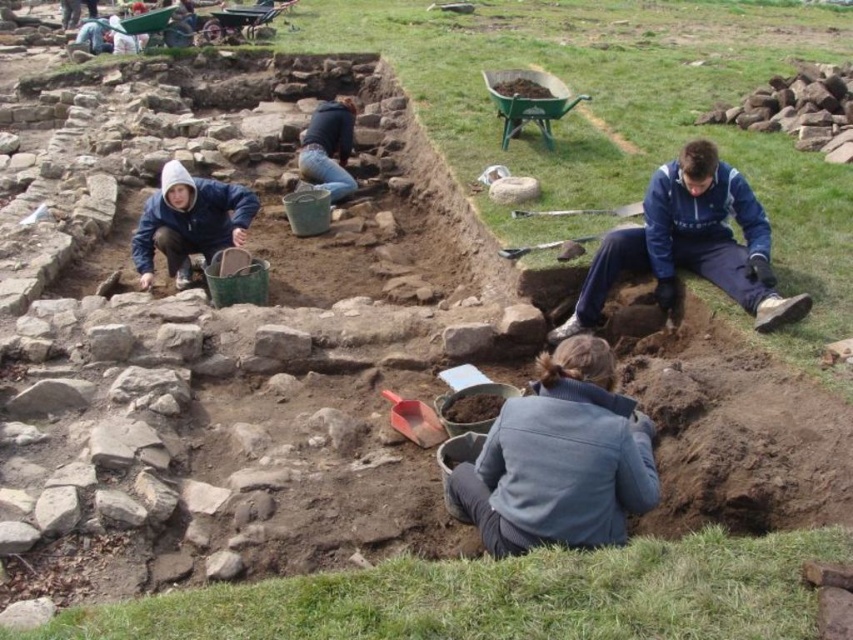
Who is lower down, blue denim jeans at center or brushed metal shovel at center?

brushed metal shovel at center is below.

Describe the element at coordinates (328, 147) in the screenshot. I see `blue denim jeans at center` at that location.

Find the location of a particular element. blue denim jeans at center is located at coordinates (328, 147).

Who is positioned more to the left, blue fleece jacket at upper left or blue denim jeans at center?

blue fleece jacket at upper left is more to the left.

Between blue fleece jacket at upper left and blue denim jeans at center, which one has less height?

blue fleece jacket at upper left

Who is more distant from viewer, (165, 182) or (317, 182)?

The point (317, 182) is more distant.

I want to click on blue fleece jacket at upper left, so click(x=189, y=221).

Which is above, red plastic shovel at center or smooth wooden shovel at center?

smooth wooden shovel at center is higher up.

Does red plastic shovel at center have a greater width compared to smooth wooden shovel at center?

No, red plastic shovel at center is not wider than smooth wooden shovel at center.

Is point (410, 426) closer to camera compared to point (589, 212)?

Yes, it is.

Where is `red plastic shovel at center`? This screenshot has height=640, width=853. red plastic shovel at center is located at coordinates (415, 420).